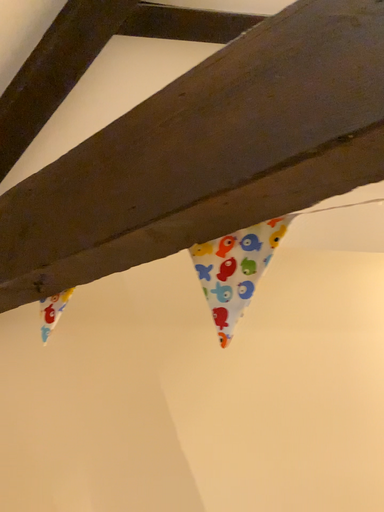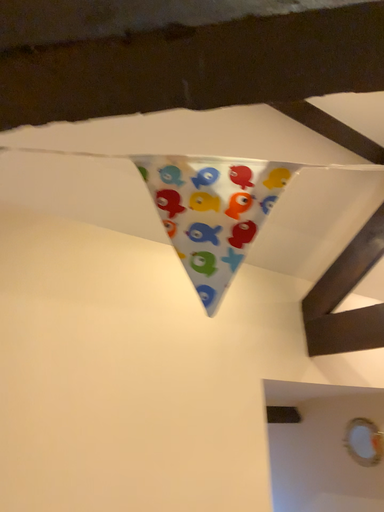
Question: How did the camera likely rotate when shooting the video?

Choices:
 (A) rotated right
 (B) rotated left

Answer: (A)